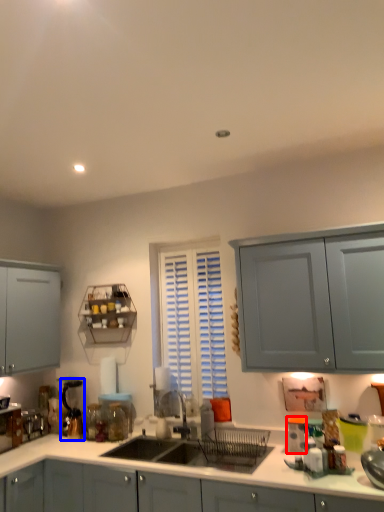
Question: Among these objects, which one is nearest to the camera, appliance (highlighted by a red box) or coffee machine (highlighted by a blue box)?

Choices:
 (A) appliance
 (B) coffee machine

Answer: (A)